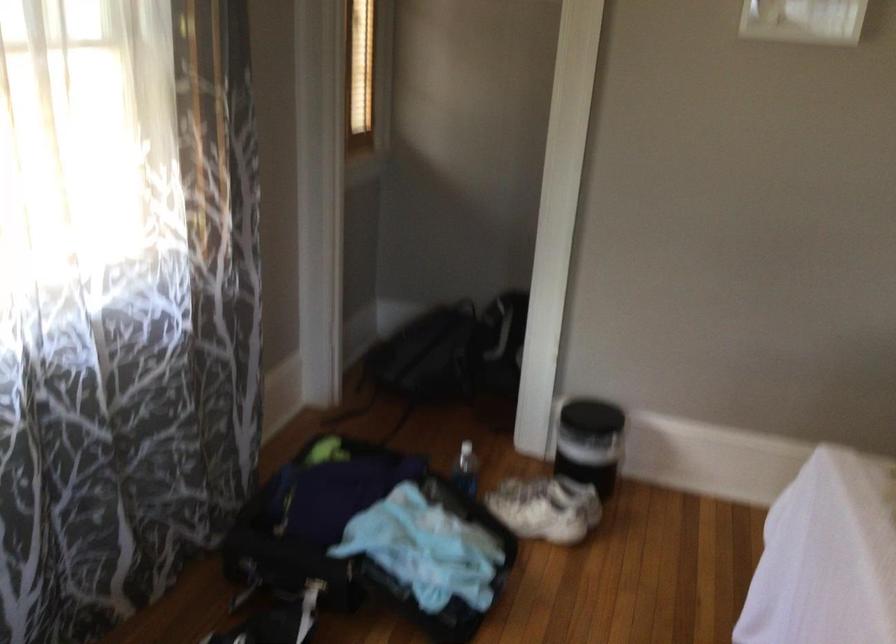
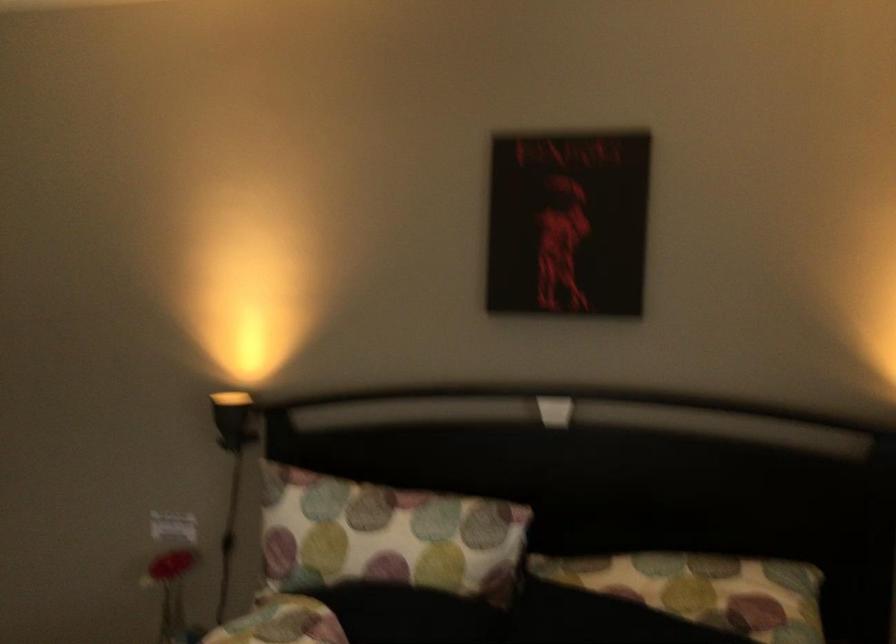
Question: Based on the continuous images, in which direction is the camera rotating? Reply with the corresponding letter.

Choices:
 (A) Left
 (B) Right
 (C) Up
 (D) Down

Answer: (B)